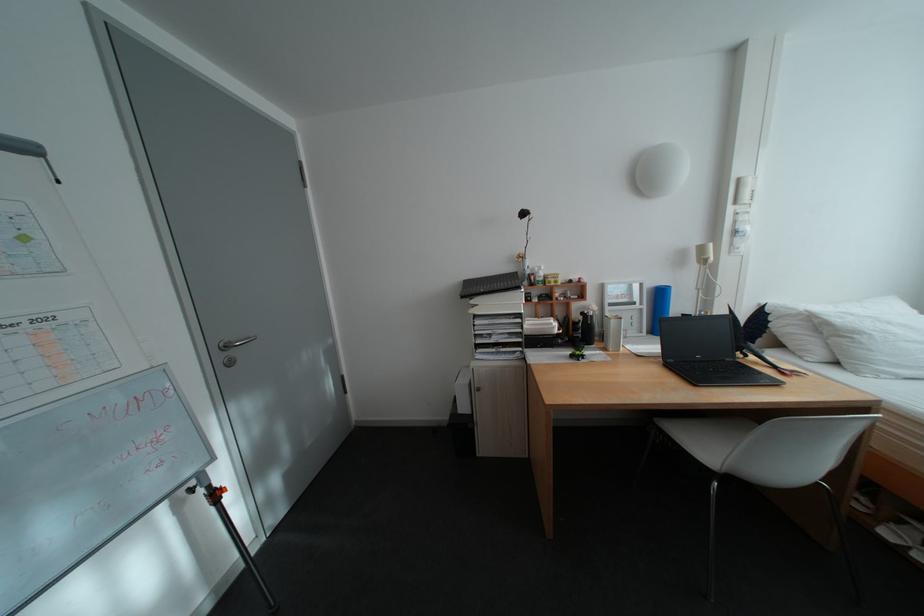
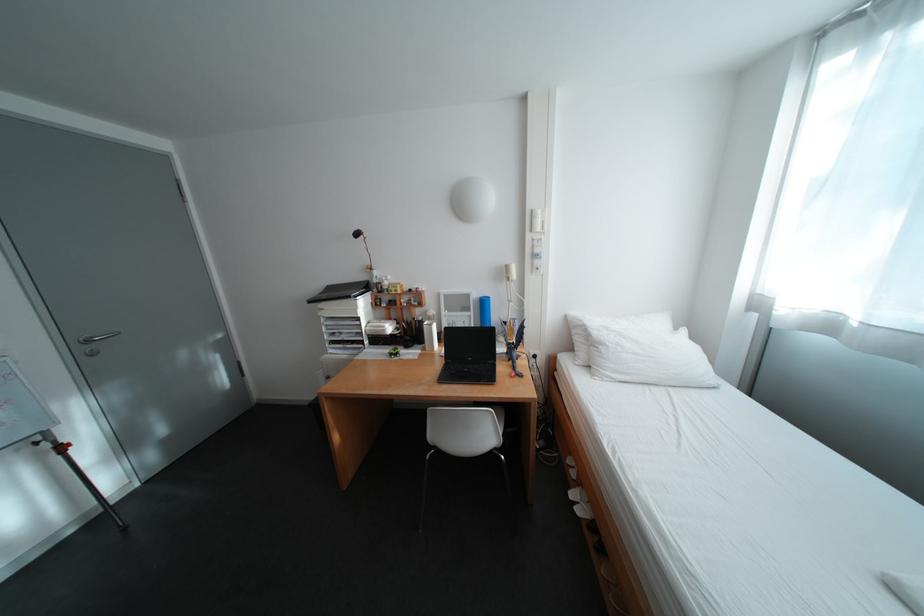
In the second image, find the point that corresponds to pixel 871 334 in the first image.

(614, 346)